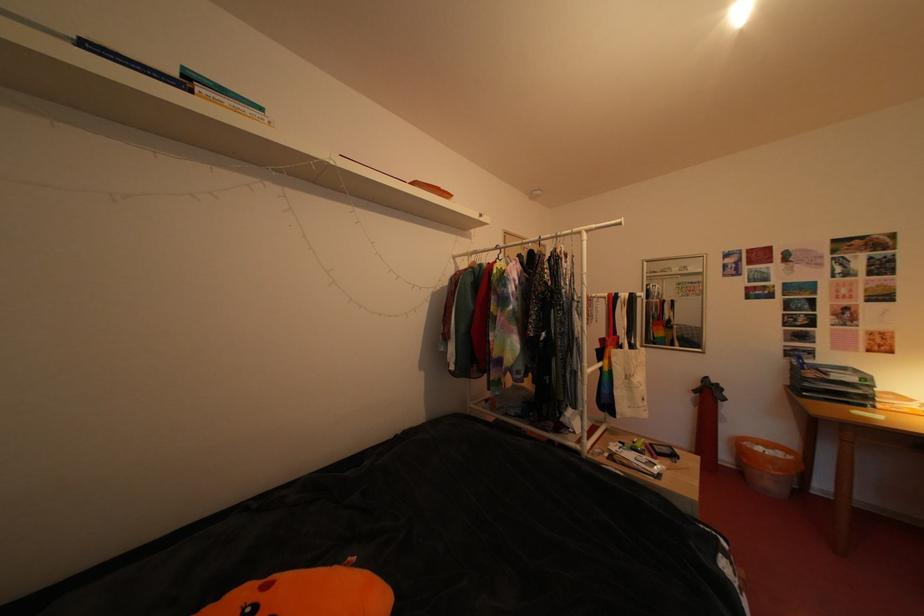
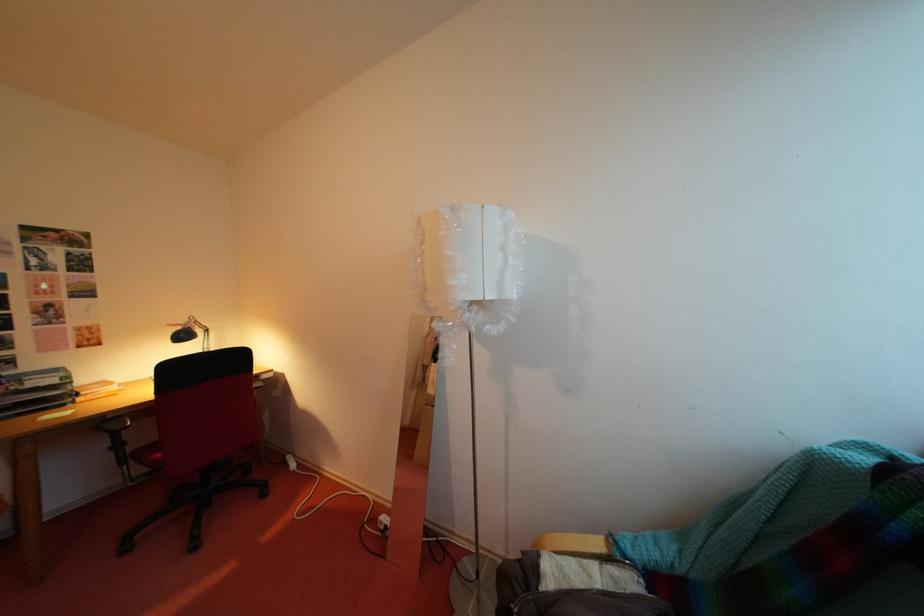
Question: The images are taken continuously from a first-person perspective. In which direction is your viewpoint rotating?

Choices:
 (A) Left
 (B) Right
 (C) Up
 (D) Down

Answer: (B)